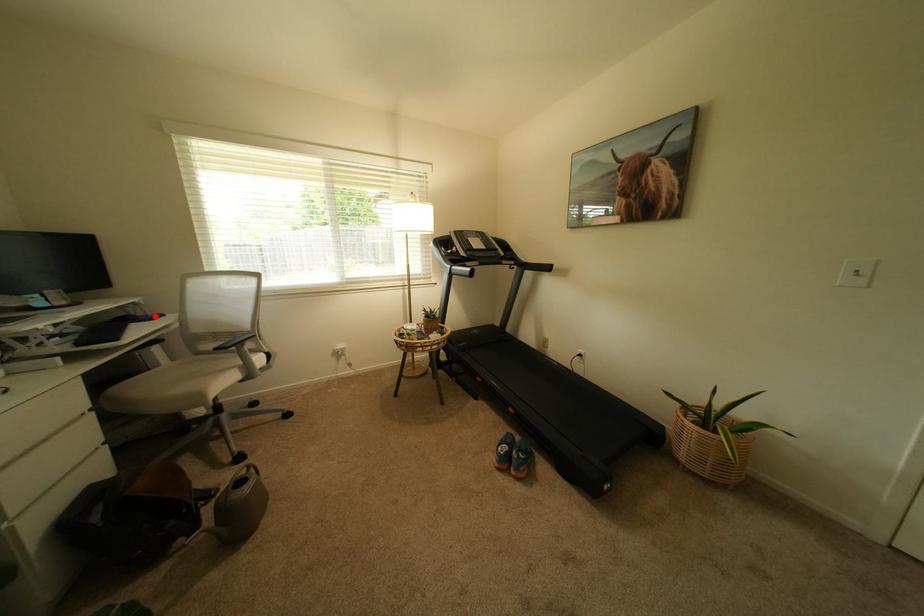
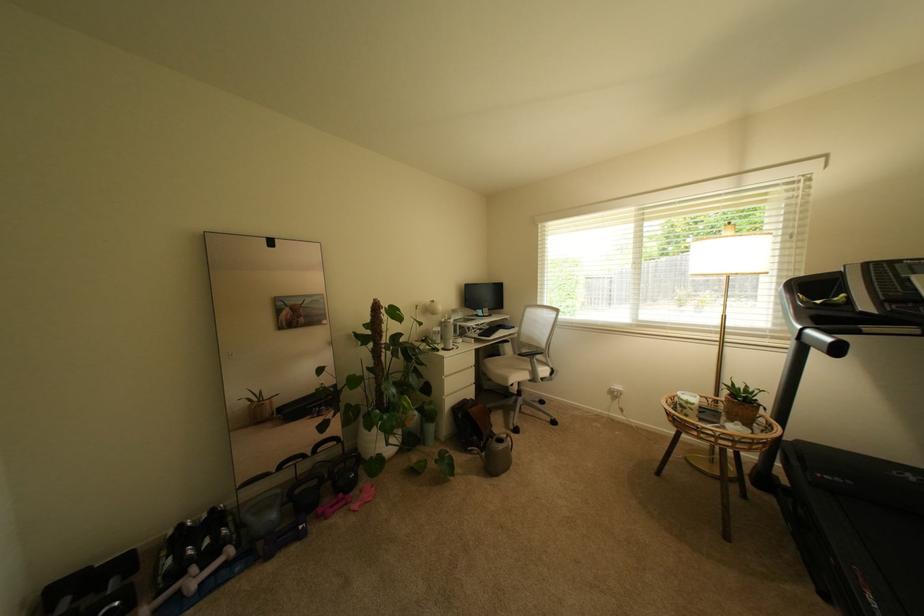
Locate, in the second image, the point that corresponds to the highlighted location in the first image.

(517, 328)